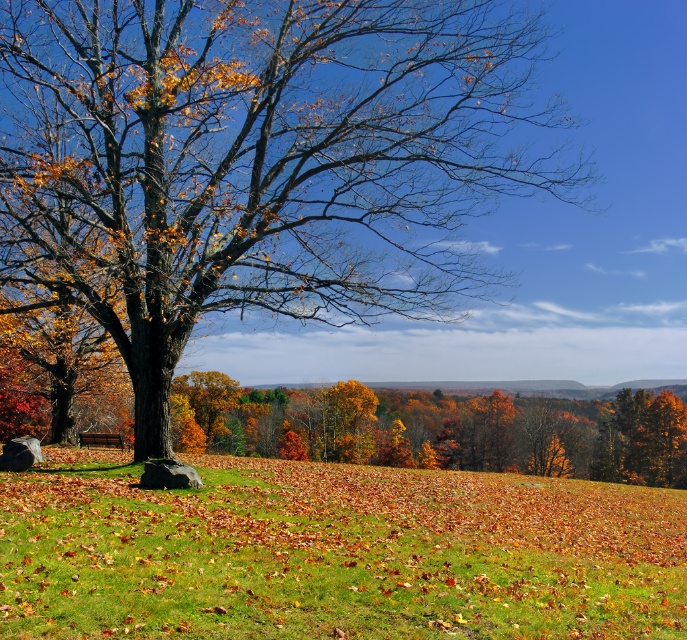
Question: Observing the image, what is the correct spatial positioning of matte brown tree at center in reference to green grassy field at center?

Choices:
 (A) left
 (B) right

Answer: (A)

Question: Is matte brown tree at center below green grassy field at center?

Choices:
 (A) yes
 (B) no

Answer: (B)

Question: Can you confirm if matte brown tree at center is positioned below green grassy field at center?

Choices:
 (A) yes
 (B) no

Answer: (B)

Question: Which object is farther from the camera taking this photo?

Choices:
 (A) matte brown tree at center
 (B) green grassy field at center

Answer: (A)